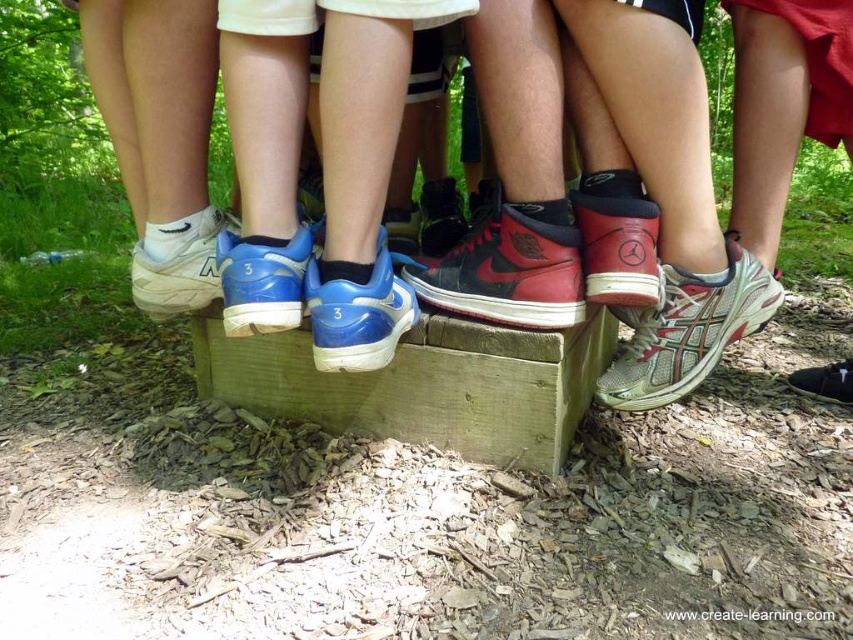
Question: Is white matte sneakers at center thinner than black leather shoe at lower right?

Choices:
 (A) yes
 (B) no

Answer: (B)

Question: Among these points, which one is nearest to the camera?

Choices:
 (A) (321, 365)
 (B) (767, 294)
 (C) (201, 252)

Answer: (A)

Question: Does shiny black high-top sneaker at center appear under blue synthetic sneaker at center?

Choices:
 (A) no
 (B) yes

Answer: (A)

Question: Is shiny red leather sneaker at center above white mesh sneaker at center?

Choices:
 (A) yes
 (B) no

Answer: (A)

Question: Which point appears farthest from the camera in this image?

Choices:
 (A) (590, 253)
 (B) (521, 346)
 (C) (386, 259)
 (D) (766, 205)

Answer: (D)

Question: Which point appears closest to the camera in this image?

Choices:
 (A) (646, 381)
 (B) (838, 371)

Answer: (A)